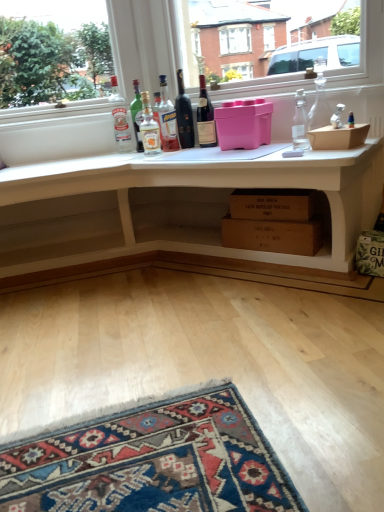
I want to click on free space above brown cardboard box at center, which is the first box from bottom to top (from a real-world perspective), so click(271, 210).